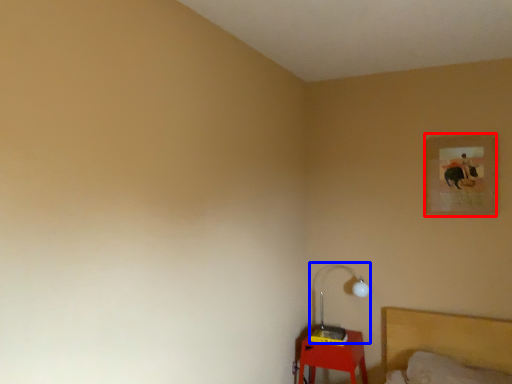
Question: Which point is closer to the camera, picture frame (highlighted by a red box) or lamp (highlighted by a blue box)?

Choices:
 (A) picture frame
 (B) lamp

Answer: (A)